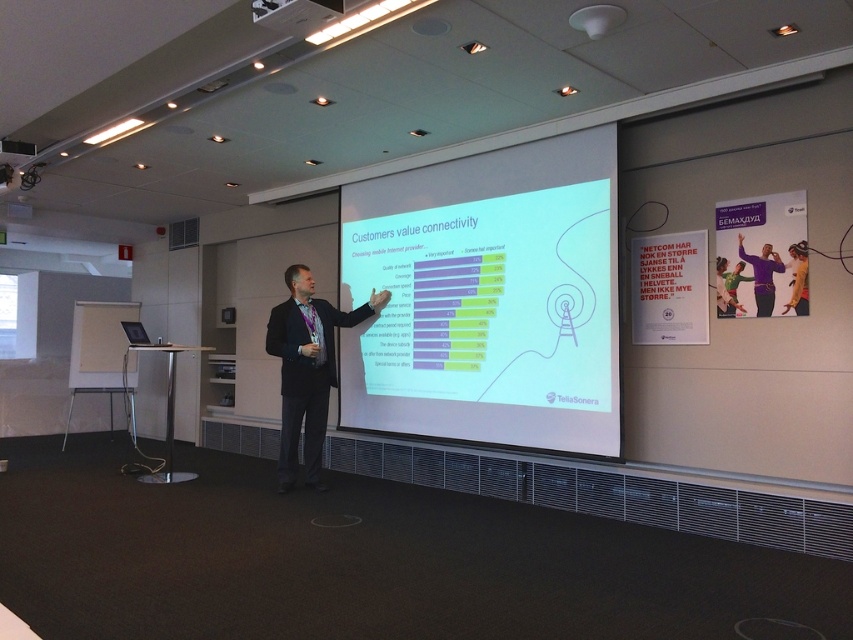
You are an attendee at the presentation and want to take a photo of the slide on the matte white projector screen at center. However, there is a white plastic projector at upper center in the way. Can you move the projector to the left to get a clear shot of the screen?

The matte white projector screen at center is positioned on the right side of the white plastic projector at upper center. Moving the projector to the left would place it to the left of the screen, potentially blocking less of the screen and allowing for a clearer photo. However, moving equipment during a presentation may be disruptive. It is advisable to check with the presenter before making any adjustments.

Looking at this image, in the conference room scene, there is a point labeled at coordinates [488,298]. Based on the scene description, what object is located at that specific coordinate?

The point at coordinates [488,298] indicates the matte white projector screen at center.

You are an attendee in the conference room and want to take a photo of the presentation slide on the matte white projector screen at center. However, the black suit at center is blocking your view. Can you adjust your position to see the entire screen?

The matte white projector screen at center is located above the black suit at center, so if you move to a position where the black suit at center is no longer between you and the screen, you should be able to see the entire matte white projector screen at center.